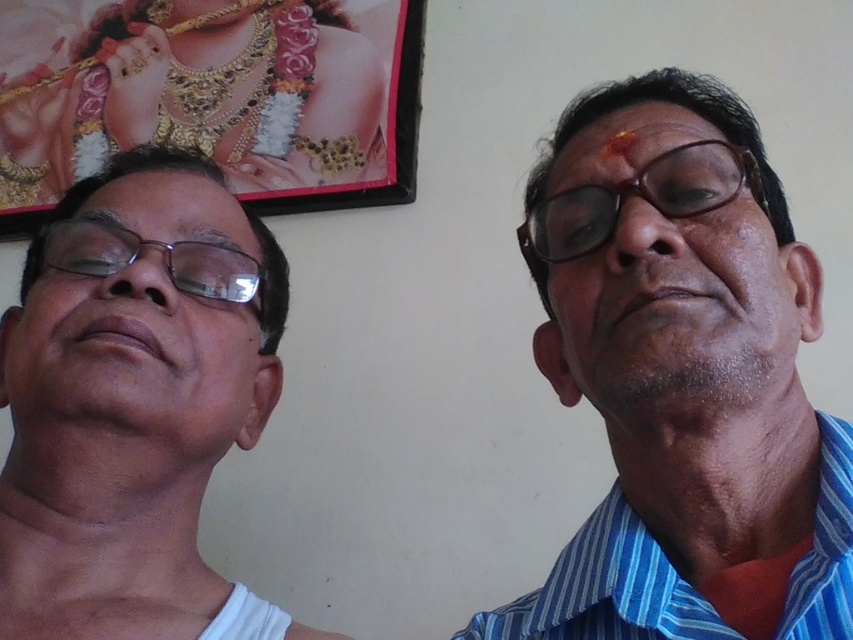
Question: Does blue striped shirt at center appear on the right side of white fabric at left?

Choices:
 (A) yes
 (B) no

Answer: (A)

Question: Which point is closer to the camera taking this photo?

Choices:
 (A) (170, 198)
 (B) (190, 253)

Answer: (B)

Question: Which of the following is the closest to the observer?

Choices:
 (A) (27, 298)
 (B) (808, 525)
 (C) (641, 227)

Answer: (C)

Question: Which of the following is the farthest from the observer?

Choices:
 (A) (645, 240)
 (B) (751, 156)
 (C) (277, 68)

Answer: (C)

Question: Does wooden frame at upper left have a lesser width compared to matte black glasses at right?

Choices:
 (A) no
 (B) yes

Answer: (A)

Question: Is the position of wooden frame at upper left less distant than that of matte blue shirt at right?

Choices:
 (A) yes
 (B) no

Answer: (B)